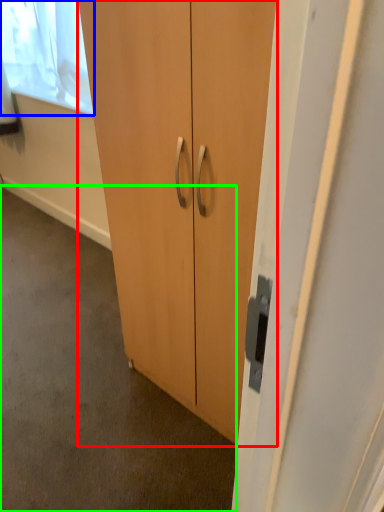
Question: Which is nearer to the cupboard (highlighted by a red box)? window screen (highlighted by a blue box) or concrete (highlighted by a green box).

Choices:
 (A) window screen
 (B) concrete

Answer: (B)